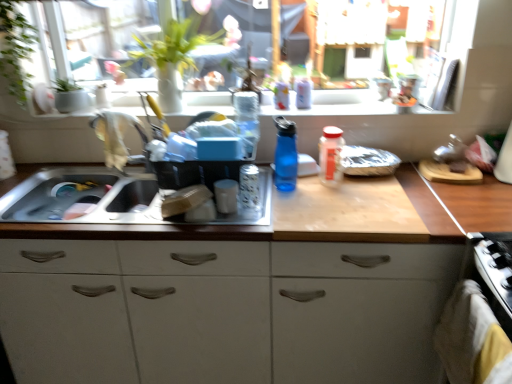
Where is `free space in front of translucent plastic bottle at center, the 1th bottle when ordered from right to left`? free space in front of translucent plastic bottle at center, the 1th bottle when ordered from right to left is located at coordinates (343, 199).